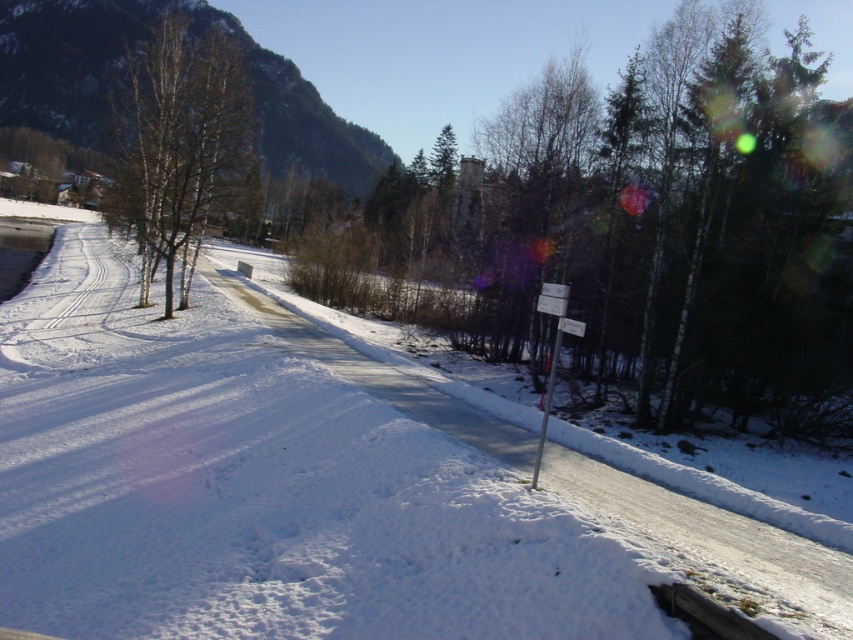
Question: Does bare birch trees at left appear on the left side of metallic pole at center-right?

Choices:
 (A) no
 (B) yes

Answer: (B)

Question: Which object is positioned closest to the brown wood signpost at center?

Choices:
 (A) white plastic sign at center-right
 (B) green forested mountain at upper left
 (C) metallic pole at center-right

Answer: (A)

Question: Does brown wood signpost at center have a larger size compared to bare birch trees at left?

Choices:
 (A) no
 (B) yes

Answer: (B)

Question: Among these points, which one is farthest from the camera?

Choices:
 (A) (543, 422)
 (B) (263, 77)
 (C) (299, 314)

Answer: (B)

Question: Which point is farther to the camera?

Choices:
 (A) brown wood signpost at center
 (B) white snow at center
 (C) bare birch trees at left
 (D) white plastic sign at center-right

Answer: (C)

Question: Is brown wood signpost at center wider than metallic pole at center-right?

Choices:
 (A) yes
 (B) no

Answer: (A)